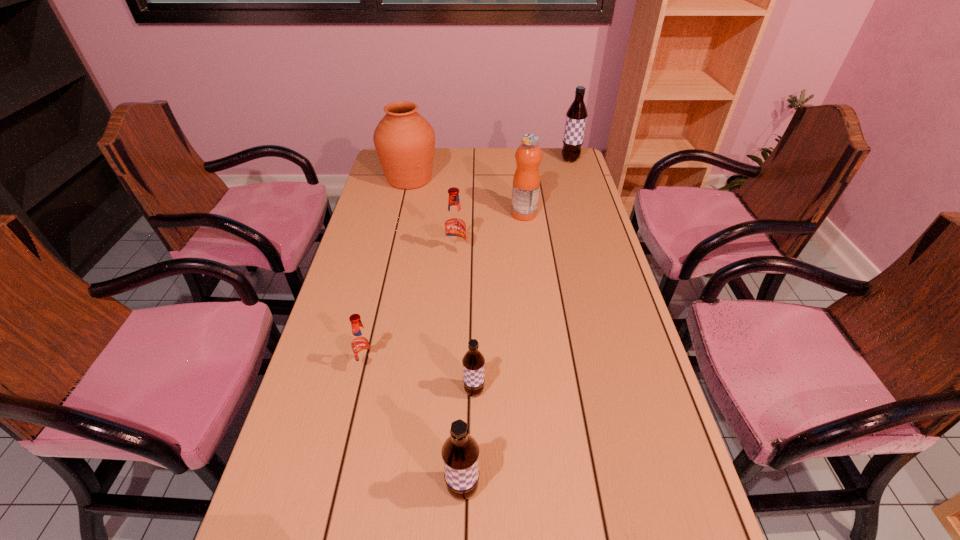
The width and height of the screenshot is (960, 540). Find the location of `the farthest object`. the farthest object is located at coordinates (576, 116).

Image resolution: width=960 pixels, height=540 pixels. I want to click on the farthest root beer, so click(x=576, y=116).

The width and height of the screenshot is (960, 540). What are the coordinates of `the second object from right to left` in the screenshot? It's located at (526, 182).

Find the location of a particular element. The height and width of the screenshot is (540, 960). the fifth nearest object is located at coordinates (526, 182).

The image size is (960, 540). Find the location of `brown urn`. brown urn is located at coordinates (405, 142).

You are a GUI agent. You are given a task and a screenshot of the screen. Output one action in this format:
    pyautogui.click(x=<x>, y=<y>)
    Task: Click on the urn
    This screenshot has height=540, width=960.
    Given the screenshot: What is the action you would take?
    pyautogui.click(x=405, y=142)

The width and height of the screenshot is (960, 540). I want to click on the right red root beer, so click(455, 225).

This screenshot has height=540, width=960. I want to click on the fourth nearest root beer, so click(x=455, y=225).

Locate an element on the screen. The image size is (960, 540). the nearest object is located at coordinates (460, 452).

This screenshot has width=960, height=540. I want to click on the nearest root beer, so click(460, 452).